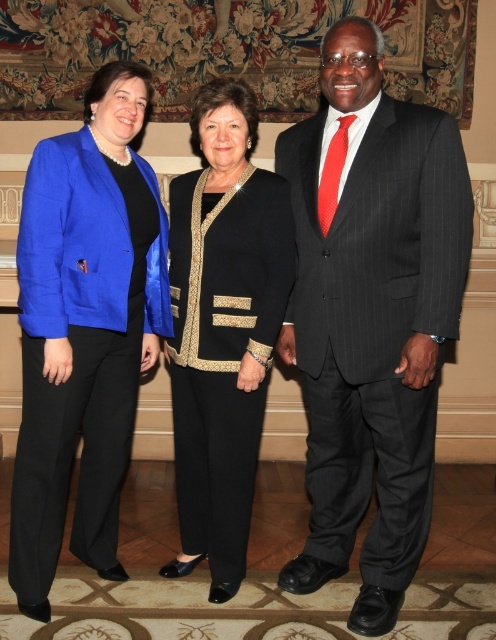
Question: Considering the relative positions of matte blue blazer at left and black textured pants at center in the image provided, where is matte blue blazer at left located with respect to black textured pants at center?

Choices:
 (A) right
 (B) left

Answer: (B)

Question: Is matte blue blazer at left wider than black textured pants at center?

Choices:
 (A) no
 (B) yes

Answer: (B)

Question: Can you confirm if pinstriped suit at center is positioned above black textured pants at center?

Choices:
 (A) no
 (B) yes

Answer: (B)

Question: Which object is the farthest from the black textured pants at center?

Choices:
 (A) matte blue blazer at left
 (B) pinstriped suit at center

Answer: (B)

Question: Which of the following is the closest to the observer?

Choices:
 (A) black textured pants at center
 (B) matte blue blazer at left

Answer: (B)

Question: Which of the following is the closest to the observer?

Choices:
 (A) pinstriped suit at center
 (B) black textured pants at center

Answer: (A)